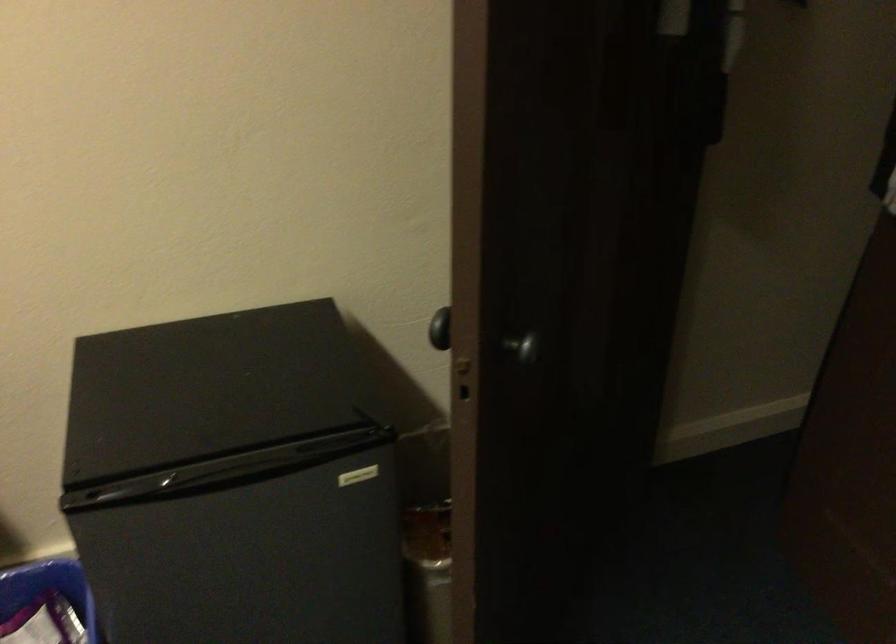
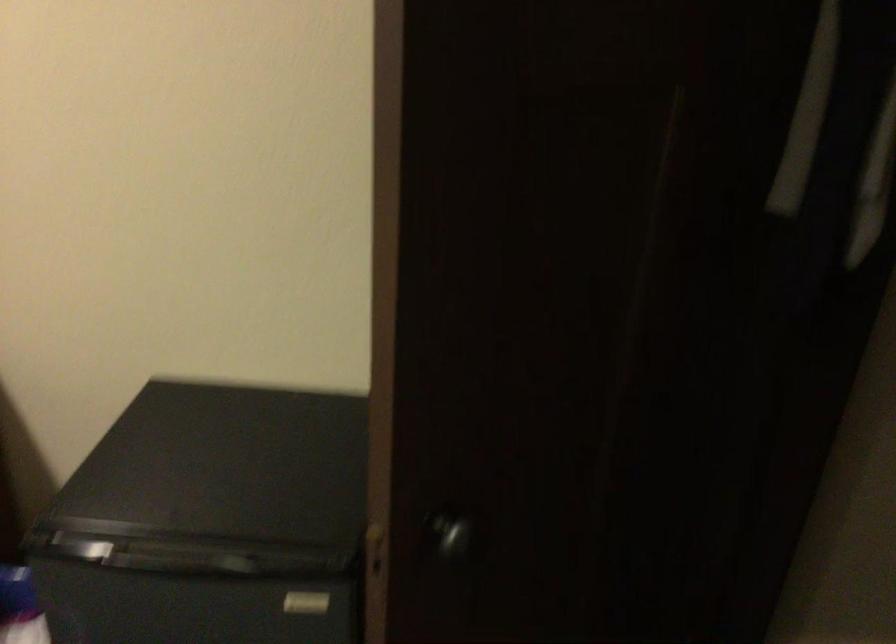
The point at (x=521, y=348) is marked in the first image. Where is the corresponding point in the second image?

(451, 535)